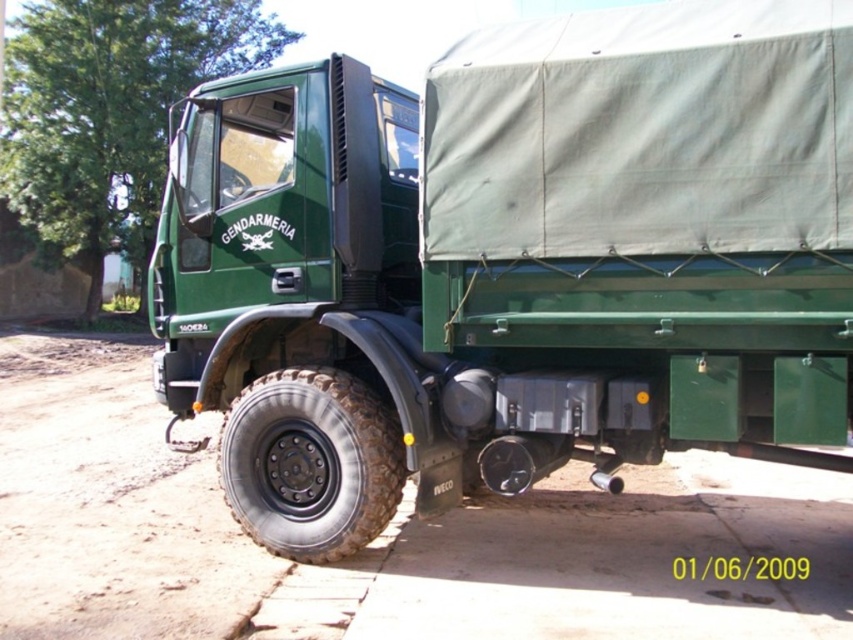
You are a photographer standing at a certain distance from the green matte truck at center. You want to take a clear photo of it without any distortion. Considering your camera has a focal length of 50mm and the recommended distance for such a shot is at least 4 meters, is your current position sufficient?

The green matte truck at center is 3.91 meters away from the viewer. Since the recommended distance is at least 4 meters, your current position is slightly too close, so you need to move back approximately 0.09 meters to achieve the desired clarity without distortion.

You are a delivery person trying to attach a package to the truck. You have two points on the truck to choose from. The first point is at coordinates point (776, 513) and the second is at point (325, 497). Which point is located further back on the truck?

Point (776, 513) is behind point (325, 497), so the first point is further back on the truck.